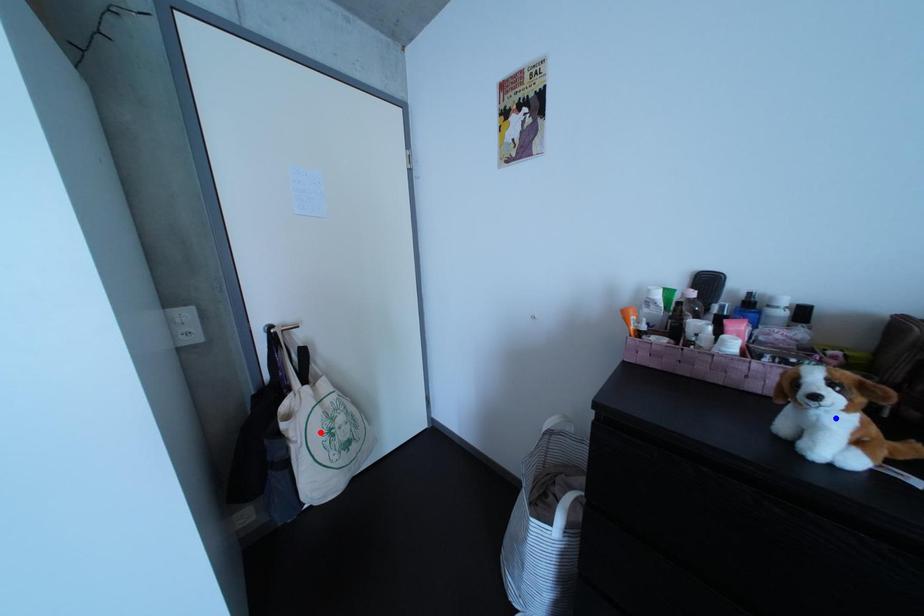
Question: Two points are marked on the image. Which point is closer to the camera?

Choices:
 (A) Blue point is closer.
 (B) Red point is closer.

Answer: (A)